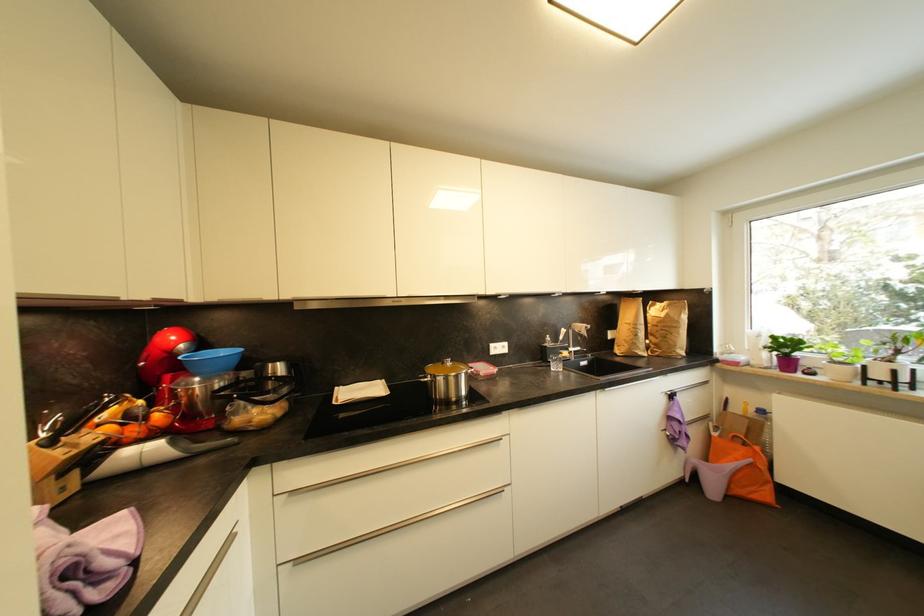
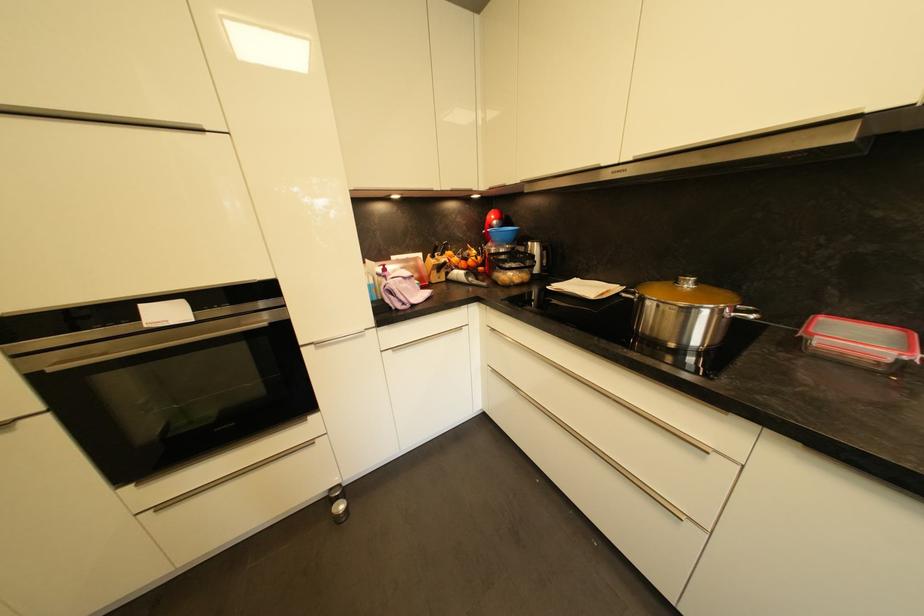
Where in the second image is the point corresponding to point (139, 432) from the first image?

(468, 265)